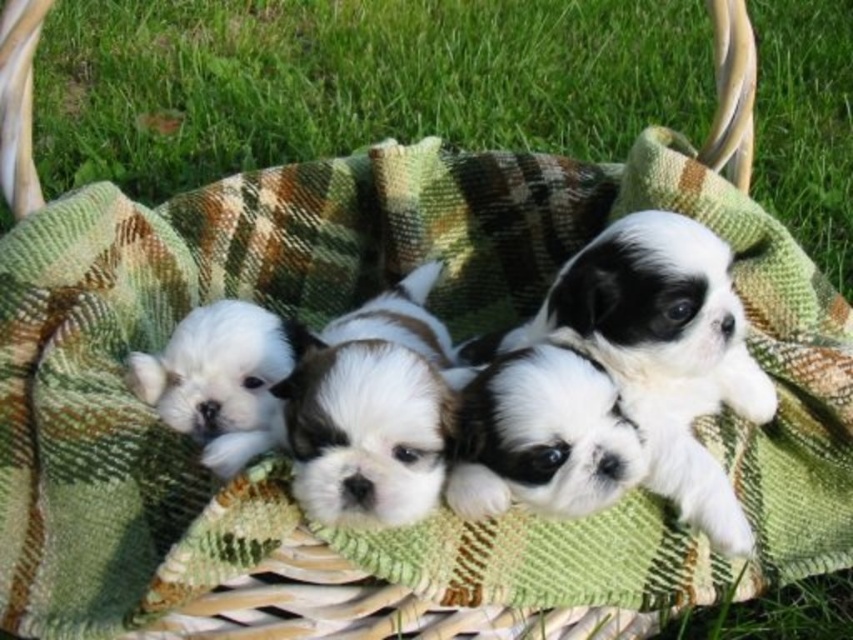
Question: Among these points, which one is nearest to the camera?

Choices:
 (A) (212, 403)
 (B) (585, 332)
 (C) (337, 342)
 (D) (16, 112)

Answer: (B)

Question: Which object appears farthest from the camera in this image?

Choices:
 (A) white fluffy dog at center
 (B) green grass at lower center
 (C) white fur at center

Answer: (B)

Question: Does black and white fur at center appear under green grass at lower center?

Choices:
 (A) yes
 (B) no

Answer: (A)

Question: Does white fur at center have a smaller size compared to green grass at lower center?

Choices:
 (A) yes
 (B) no

Answer: (B)

Question: Which point appears closest to the camera in this image?

Choices:
 (A) (547, 404)
 (B) (450, 342)
 (C) (718, 481)

Answer: (A)

Question: Can you confirm if white fluffy dog at center is positioned to the right of green grass at lower center?

Choices:
 (A) no
 (B) yes

Answer: (A)